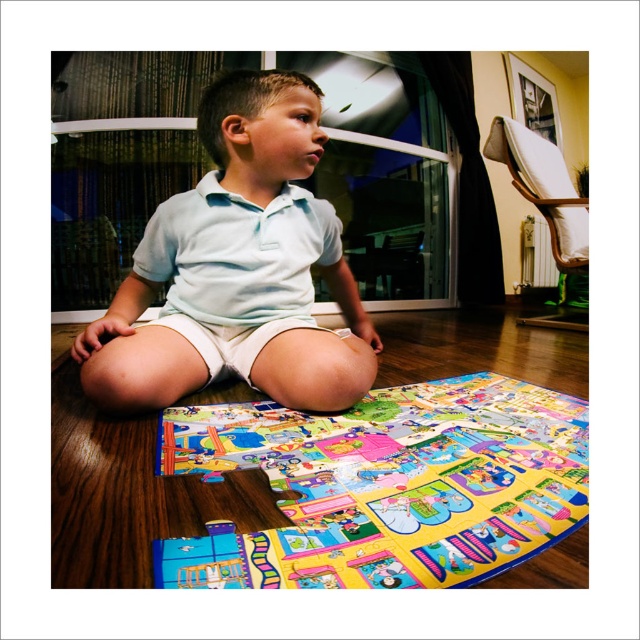
Question: Is colorful plastic puzzle at lower center behind light blue cotton shirt at center?

Choices:
 (A) no
 (B) yes

Answer: (A)

Question: Does colorful plastic puzzle at lower center have a larger size compared to light blue cotton shirt at center?

Choices:
 (A) yes
 (B) no

Answer: (B)

Question: Which point is closer to the camera taking this photo?

Choices:
 (A) (129, 358)
 (B) (451, 464)

Answer: (B)

Question: From the image, what is the correct spatial relationship of colorful plastic puzzle at lower center in relation to light blue cotton shirt at center?

Choices:
 (A) below
 (B) above

Answer: (A)